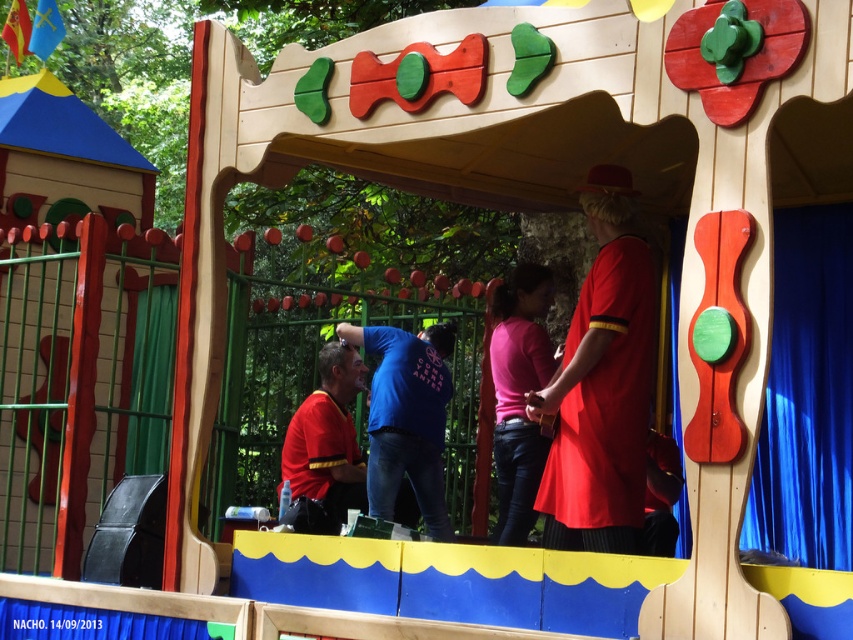
Question: Among these objects, which one is nearest to the camera?

Choices:
 (A) pink matte shirt at center
 (B) blue cotton shirt at center
 (C) matte red dress at center

Answer: (C)

Question: Which of the following is the closest to the observer?

Choices:
 (A) (328, 506)
 (B) (430, 490)

Answer: (A)

Question: Is pink matte shirt at center positioned in front of matte red shirt at center?

Choices:
 (A) no
 (B) yes

Answer: (B)

Question: Which of the following is the closest to the observer?

Choices:
 (A) (416, 410)
 (B) (569, 531)
 (C) (491, 376)
 (D) (332, 504)

Answer: (B)

Question: Observing the image, what is the correct spatial positioning of matte red dress at center in reference to blue cotton shirt at center?

Choices:
 (A) above
 (B) below

Answer: (A)

Question: From the image, what is the correct spatial relationship of matte red dress at center in relation to blue cotton shirt at center?

Choices:
 (A) right
 (B) left

Answer: (A)